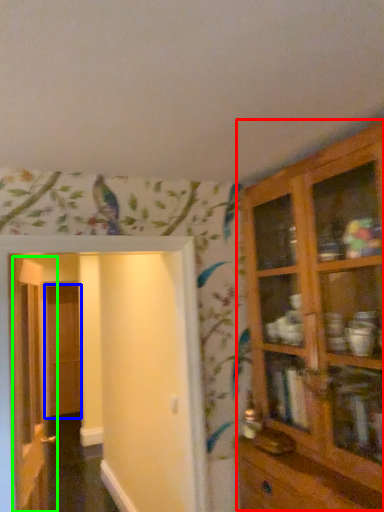
Question: Based on their relative distances, which object is farther from cupboard (highlighted by a red box)? Choose from door (highlighted by a blue box) and door (highlighted by a green box).

Choices:
 (A) door
 (B) door

Answer: (A)